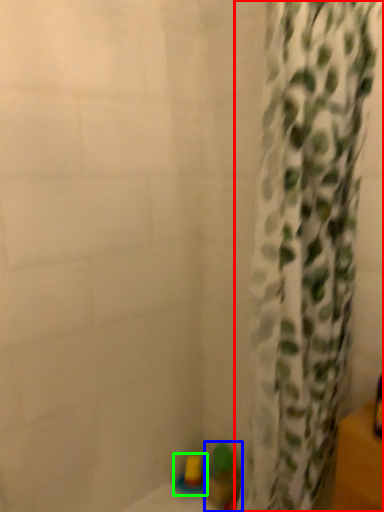
Question: Which object is positioned farthest from curtain (highlighted by a red box)? Select from toy (highlighted by a blue box) and toy (highlighted by a green box).

Choices:
 (A) toy
 (B) toy

Answer: (B)